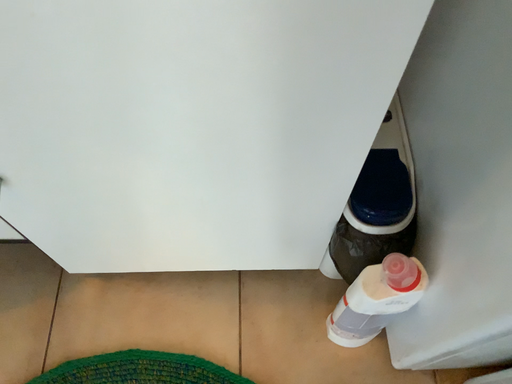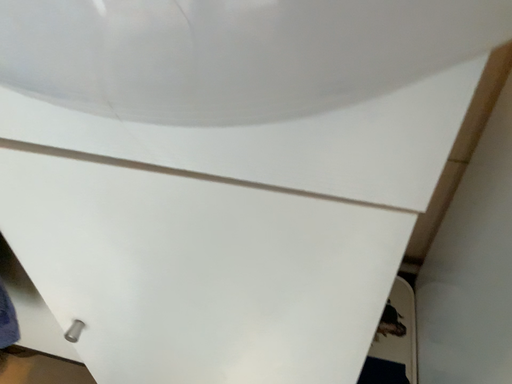
Question: Which way did the camera rotate in the video?

Choices:
 (A) rotated upward
 (B) rotated downward

Answer: (A)